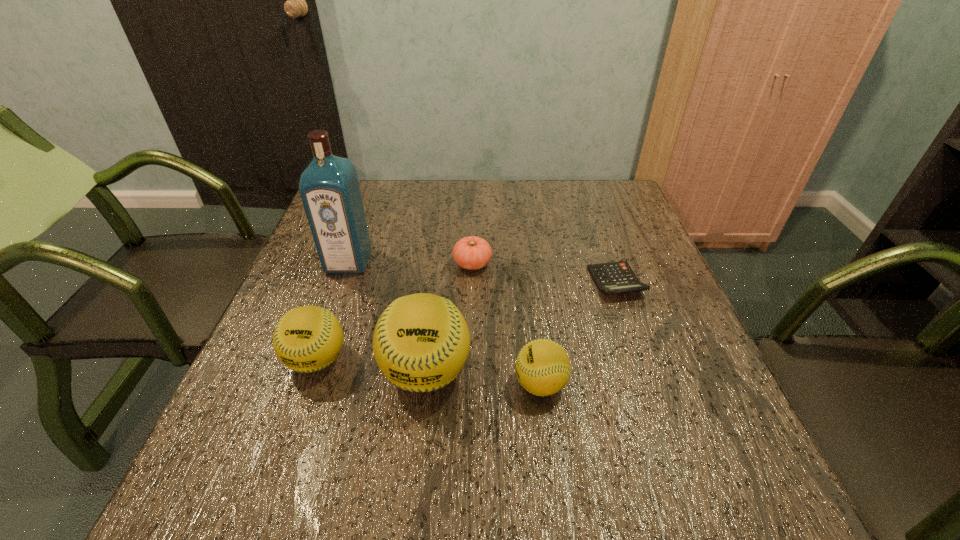
Where is `the fourth shortest object`? the fourth shortest object is located at coordinates (309, 338).

Find the location of a particular element. the second tallest softball is located at coordinates (309, 338).

Image resolution: width=960 pixels, height=540 pixels. I want to click on the second softball from right to left, so click(x=421, y=341).

This screenshot has width=960, height=540. In order to click on the tallest softball in this screenshot , I will do `click(421, 341)`.

This screenshot has height=540, width=960. What are the coordinates of `the rightmost softball` in the screenshot? It's located at (543, 368).

Where is `the fourth tallest object`? The height and width of the screenshot is (540, 960). the fourth tallest object is located at coordinates (543, 368).

Locate an element on the screen. the tallest object is located at coordinates (329, 187).

What are the coordinates of `calculator` in the screenshot? It's located at (616, 277).

The height and width of the screenshot is (540, 960). In order to click on the rightmost object in this screenshot , I will do (x=616, y=277).

What are the coordinates of `the fifth tallest object` in the screenshot? It's located at (472, 253).